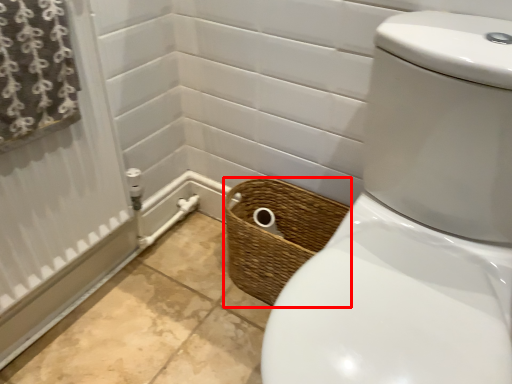
Question: From the image's perspective, where is basket (annotated by the red box) located in relation to curtain in the image?

Choices:
 (A) below
 (B) above

Answer: (A)